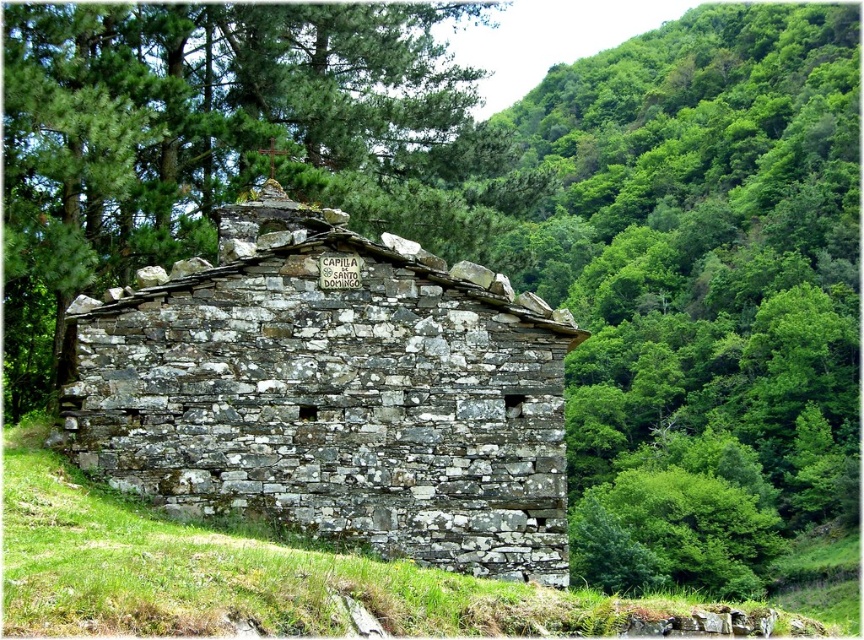
Question: Does gray stone hut at center appear under green leafy tree at upper center?

Choices:
 (A) yes
 (B) no

Answer: (A)

Question: Which of these objects is positioned closest to the gray stone wall at center?

Choices:
 (A) green leafy tree at upper center
 (B) gray stone hut at center

Answer: (B)

Question: Can you confirm if green leafy tree at upper center is bigger than gray stone wall at center?

Choices:
 (A) no
 (B) yes

Answer: (A)

Question: Which object is the farthest from the gray stone wall at center?

Choices:
 (A) gray stone hut at center
 (B) green leafy tree at upper center

Answer: (B)

Question: Can you confirm if gray stone hut at center is positioned below gray stone wall at center?

Choices:
 (A) yes
 (B) no

Answer: (B)

Question: Which point is closer to the camera?

Choices:
 (A) (176, 60)
 (B) (836, 605)

Answer: (A)